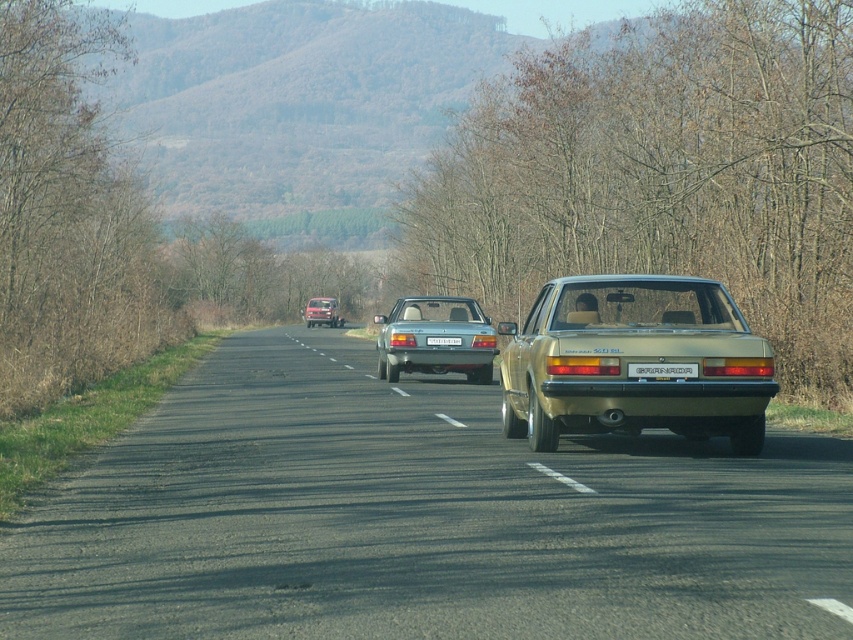
Question: Which object is the closest to the white plastic license plate at rear?

Choices:
 (A) asphalt road at center
 (B) white plastic license plate at center
 (C) gold metallic sedan at center

Answer: (C)

Question: Does asphalt road at center come behind gold metallic sedan at center?

Choices:
 (A) yes
 (B) no

Answer: (B)

Question: Can you confirm if gold metallic sedan at center is positioned below metallic silver sedan at center?

Choices:
 (A) no
 (B) yes

Answer: (A)

Question: Which point is farther from the camera taking this photo?

Choices:
 (A) (692, 364)
 (B) (428, 333)
 (C) (263, 376)
 (D) (305, 321)

Answer: (D)

Question: Does gold metallic sedan at center appear on the left side of white plastic license plate at center?

Choices:
 (A) yes
 (B) no

Answer: (B)

Question: Which of the following is the farthest from the observer?

Choices:
 (A) (320, 321)
 (B) (695, 371)
 (C) (459, 340)
 (D) (366, 541)

Answer: (A)